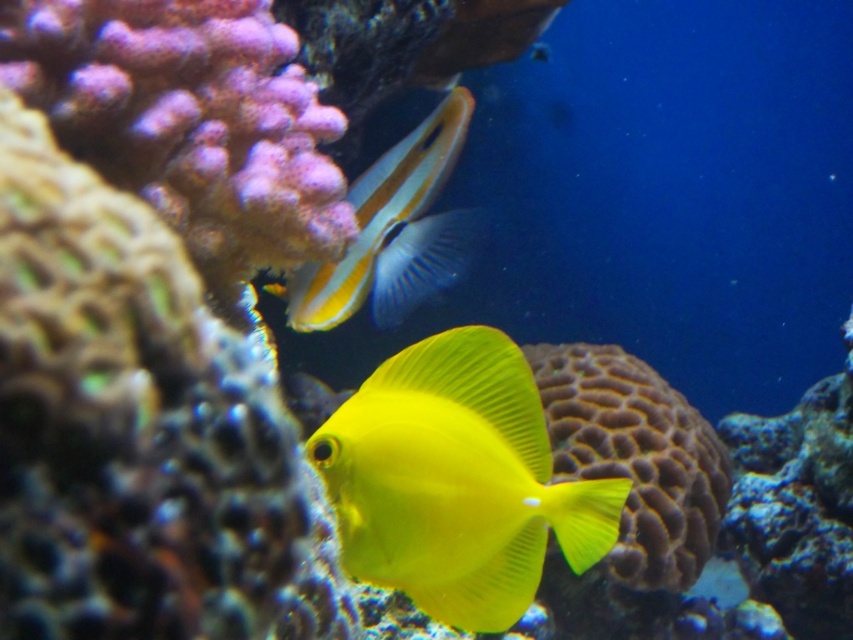
Which of these two, yellow matte fish at center or shiny yellow fish at center, stands taller?

shiny yellow fish at center

Is yellow matte fish at center smaller than shiny yellow fish at center?

Correct, yellow matte fish at center occupies less space than shiny yellow fish at center.

Is point (599, 499) closer to viewer compared to point (399, 147)?

Yes, point (599, 499) is closer to viewer.

This screenshot has height=640, width=853. Identify the location of yellow matte fish at center. (456, 481).